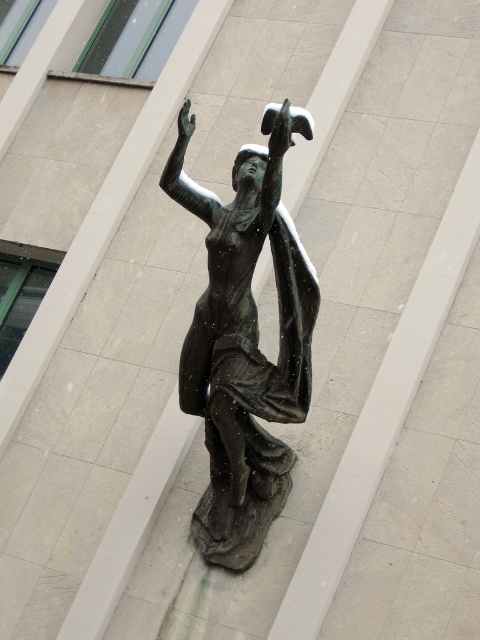
From the picture: Can you confirm if bronze statue at center is positioned to the left of bronze/golden at upper center?

Incorrect, bronze statue at center is not on the left side of bronze/golden at upper center.

Which is more to the right, bronze statue at center or bronze/golden at upper center?

Positioned to the right is bronze statue at center.

Does point (264, 188) come farther from viewer compared to point (183, 129)?

No, (264, 188) is closer to viewer.

At what (x,y) coordinates should I click in order to perform the action: click on bronze statue at center. Please return your answer as a coordinate pair (x, y). Looking at the image, I should click on (245, 344).